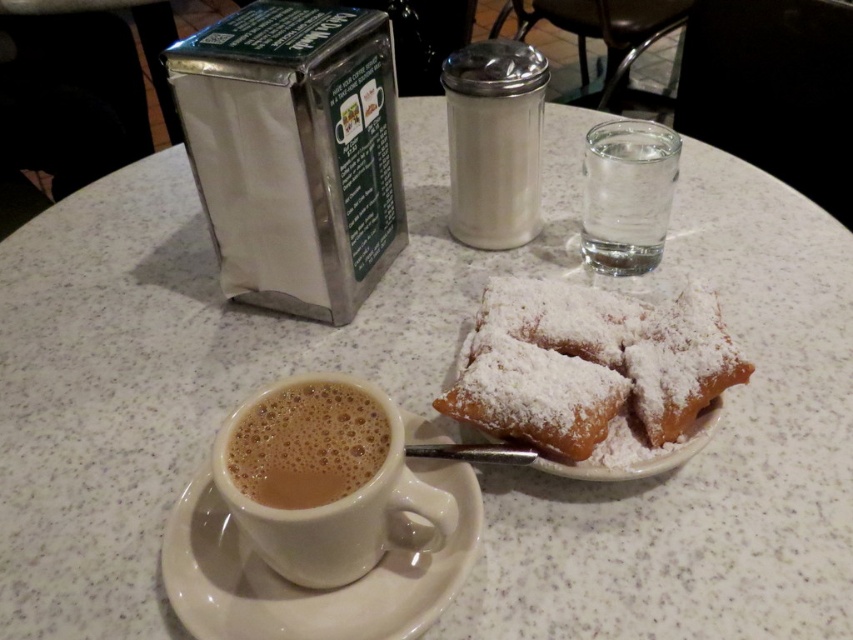
You are a barista checking the height of drinks for a customer who prefers shorter cups. You see the brown frothy coffee at lower left and the clear glass water at upper right. Which one is shorter?

The brown frothy coffee at lower left is shorter than the clear glass water at upper right.

You are a customer at the cafe and want to add sugar to your brown frothy coffee at lower left. The sugar shaker is the satin silver sugar shaker at upper center. Can you reach the sugar shaker without moving your chair?

The satin silver sugar shaker at upper center is larger in size than brown frothy coffee at lower left, but the question about reachability isn